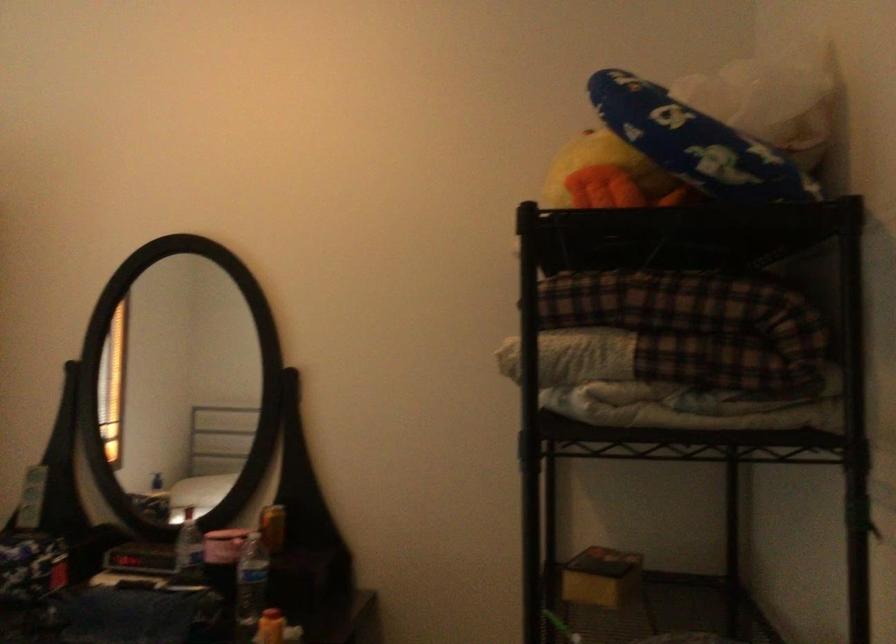
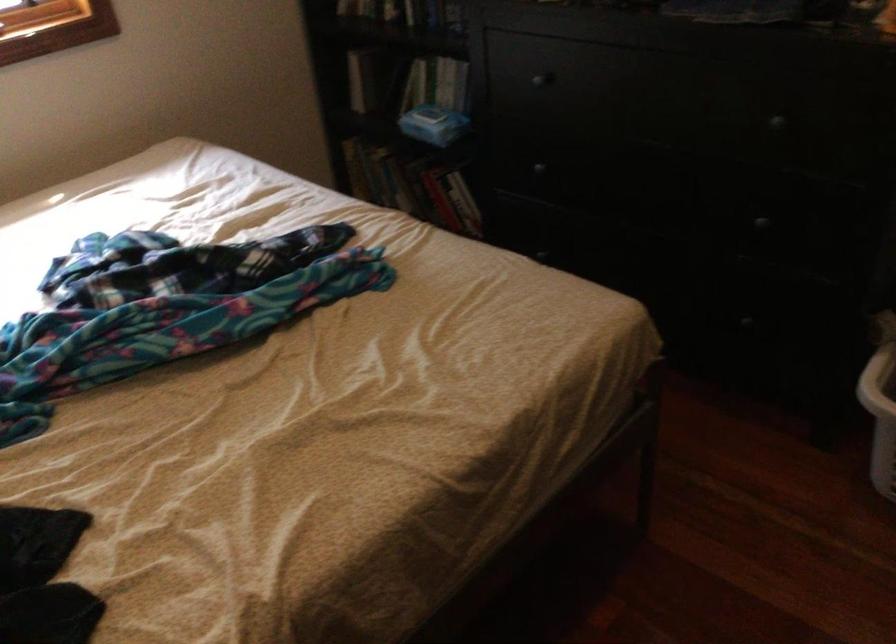
Based on the continuous images, in which direction is the camera rotating?

The rotation direction of the camera is left-down.